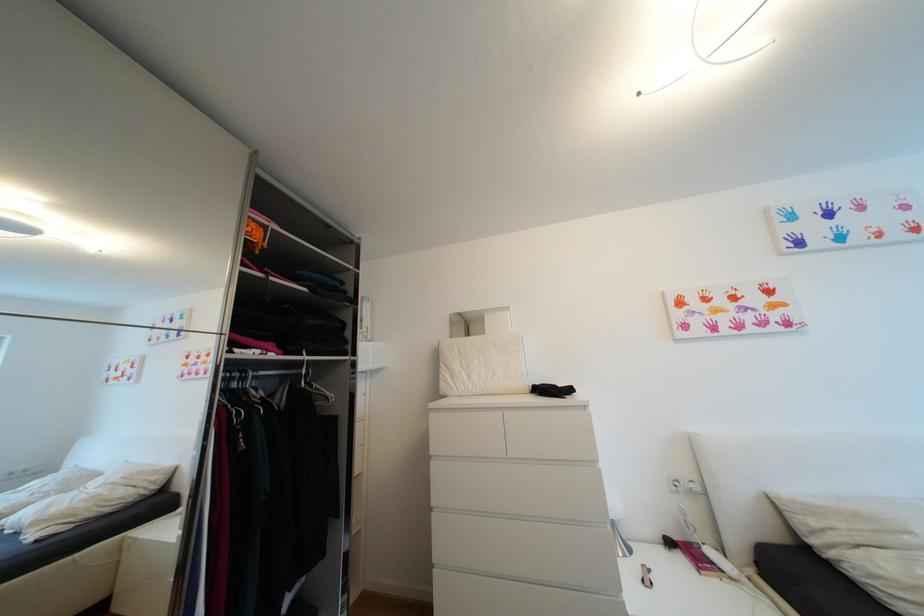
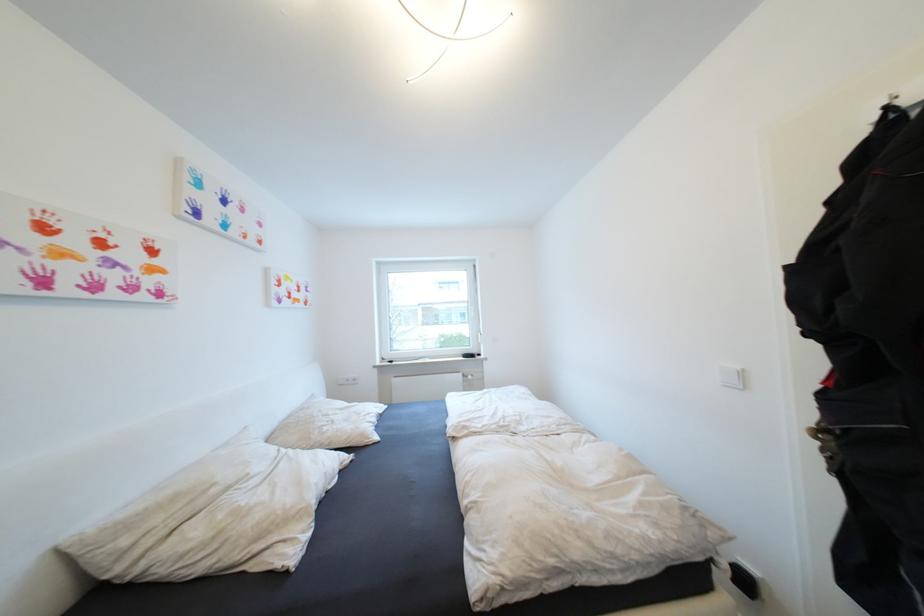
Where in the second image is the point corresponding to pixel 821 524 from the first image?

(131, 543)